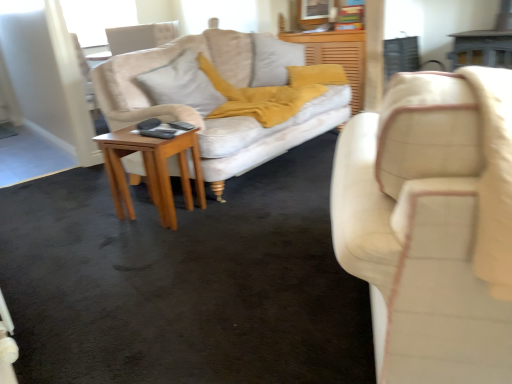
Question: Considering the positions of point (110, 145) and point (422, 107), is point (110, 145) closer or farther from the camera than point (422, 107)?

Choices:
 (A) farther
 (B) closer

Answer: (A)

Question: From the image's perspective, relative to matte cream studio couch at right, is light brown wooden side table at center above or below?

Choices:
 (A) above
 (B) below

Answer: (A)

Question: Estimate the real-world distances between objects in this image. Which object is closer to the light brown wooden side table at center?

Choices:
 (A) wooden dresser at center
 (B) matte cream studio couch at right
 (C) light gray fabric pillow at center

Answer: (C)

Question: Considering the real-world distances, which object is closest to the light gray fabric pillow at center?

Choices:
 (A) matte cream studio couch at right
 (B) wooden dresser at center
 (C) light brown wooden side table at center

Answer: (C)